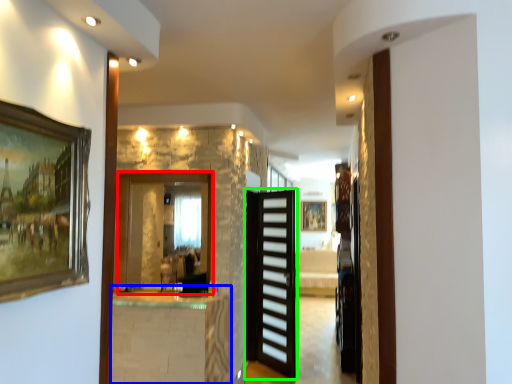
Question: Based on their relative distances, which object is farther from mirror (highlighted by a red box)? Choose from table (highlighted by a blue box) and door (highlighted by a green box).

Choices:
 (A) table
 (B) door

Answer: (B)